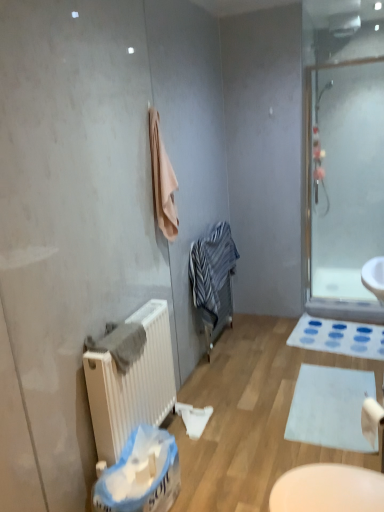
Question: Is striped cotton bathrobe at center inside the boundaries of white fabric bath mat at lower right, which ranks as the second bath mat in bottom-to-top order, or outside?

Choices:
 (A) outside
 (B) inside

Answer: (A)

Question: From the image's perspective, is striped cotton bathrobe at center positioned above or below white fabric bath mat at lower right, which is counted as the 2th bath mat, starting from the front?

Choices:
 (A) above
 (B) below

Answer: (A)

Question: Estimate the real-world distances between objects in this image. Which object is closer to the gray cotton towel at left, which is counted as the 1th bath towel, starting from the bottom?

Choices:
 (A) white fabric bath mat at lower right, which ranks as the second bath mat in bottom-to-top order
 (B) white matte bath mat at lower center, acting as the first bath mat starting from the bottom
 (C) beige soft towel at upper center, which is counted as the 2th bath towel, starting from the left
 (D) transparent glass shower door at right
 (E) blue plastic laundry basket at lower center

Answer: (E)

Question: Which object is positioned closest to the white matte toilet paper at lower right?

Choices:
 (A) blue plastic laundry basket at lower center
 (B) white matte bath mat at lower center, which is the second bath mat from top to bottom
 (C) beige soft towel at upper center, which ranks as the first bath towel in back-to-front order
 (D) white fabric bath mat at lower right, which is counted as the 2th bath mat, starting from the front
 (E) gray cotton towel at left, positioned as the 2th bath towel in top-to-bottom order

Answer: (B)